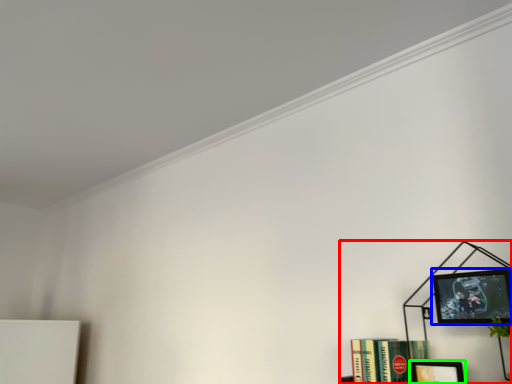
Question: Estimate the real-world distances between objects in this image. Which object is farther from bookcase (highlighted by a red box), picture frame (highlighted by a blue box) or picture frame (highlighted by a green box)?

Choices:
 (A) picture frame
 (B) picture frame

Answer: (A)